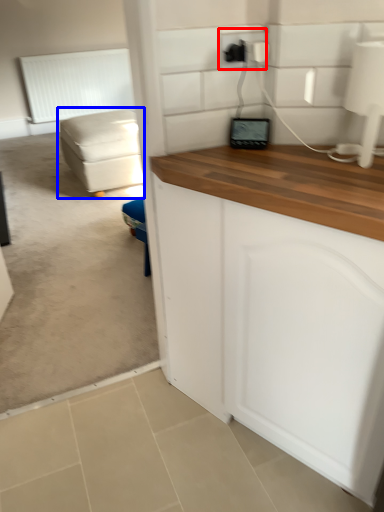
Question: Among these objects, which one is nearest to the camera, electric outlet (highlighted by a red box) or studio couch (highlighted by a blue box)?

Choices:
 (A) electric outlet
 (B) studio couch

Answer: (A)